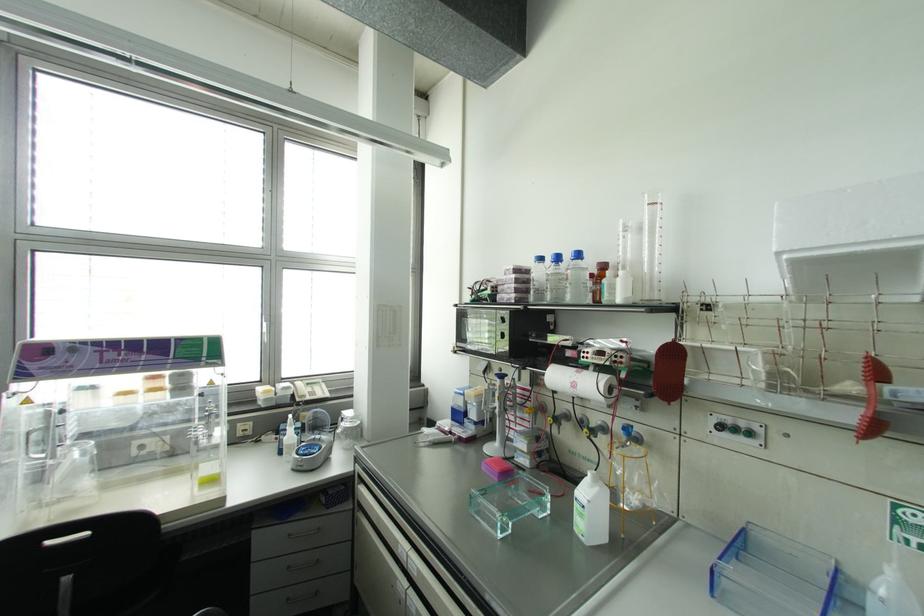
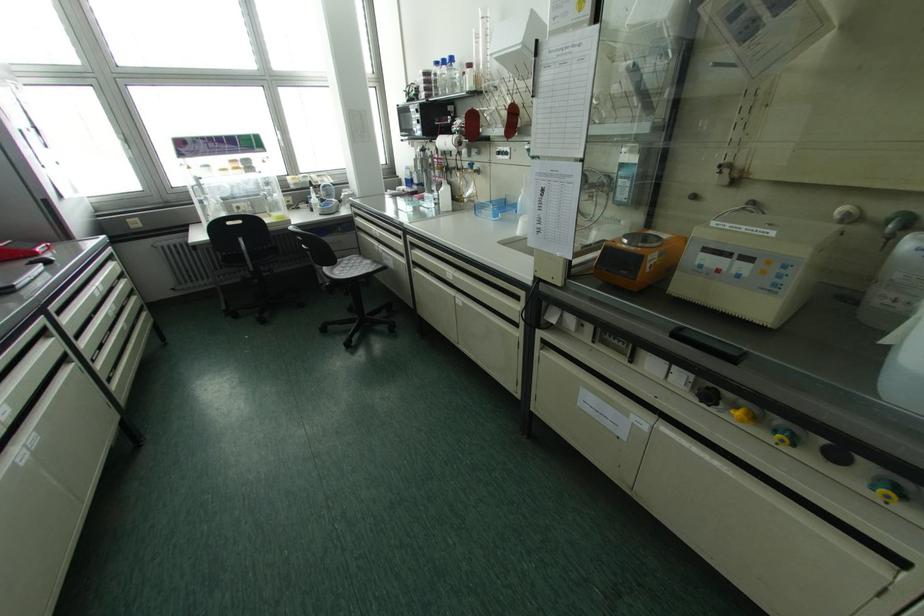
The point at [721,427] is marked in the first image. Where is the corresponding point in the second image?

(497, 153)